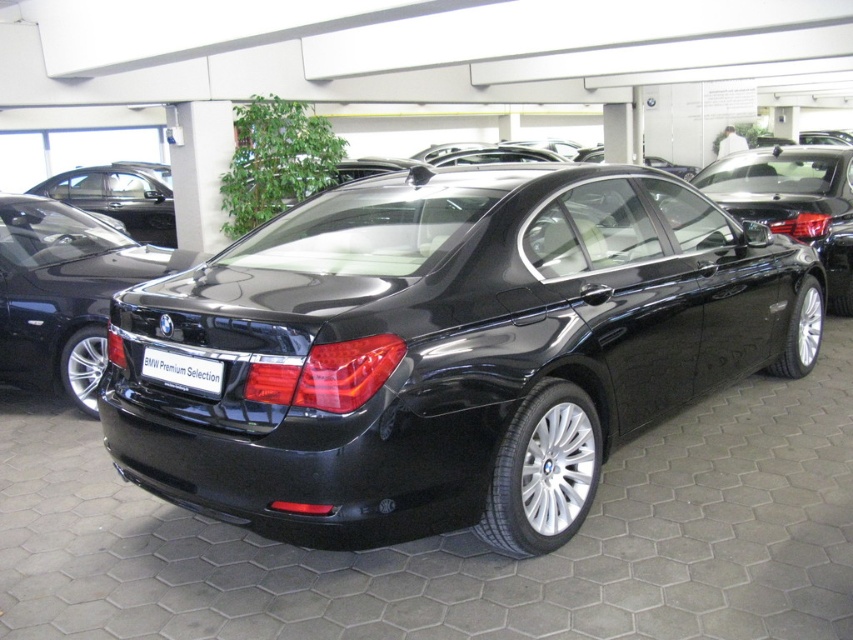
Question: Where is black metallic sedan at center located in relation to glossy black sedan at center in the image?

Choices:
 (A) below
 (B) above

Answer: (A)

Question: Does matte black car at center have a smaller size compared to matte black sedan at upper left?

Choices:
 (A) yes
 (B) no

Answer: (A)

Question: Among these objects, which one is farthest from the camera?

Choices:
 (A) matte black car at center
 (B) matte black sedan at upper left
 (C) black metallic sedan at center

Answer: (B)

Question: Is black metallic sedan at center positioned at the back of matte black sedan at upper left?

Choices:
 (A) no
 (B) yes

Answer: (A)

Question: Among these objects, which one is farthest from the camera?

Choices:
 (A) black metallic sedan at center
 (B) matte black car at center
 (C) matte black sedan at upper left
 (D) glossy black sedan at center

Answer: (C)

Question: Estimate the real-world distances between objects in this image. Which object is closer to the black plastic license plate at rear?

Choices:
 (A) black metallic sedan at center
 (B) matte black sedan at upper left
 (C) glossy black sedan at center
 (D) matte black car at center

Answer: (A)